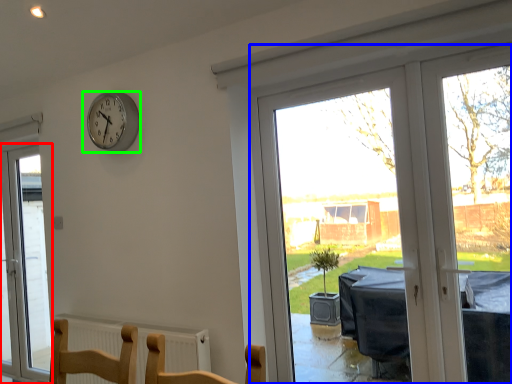
Question: Which is nearer to the window (highlighted by a red box)? window (highlighted by a blue box) or wall clock (highlighted by a green box).

Choices:
 (A) window
 (B) wall clock

Answer: (B)